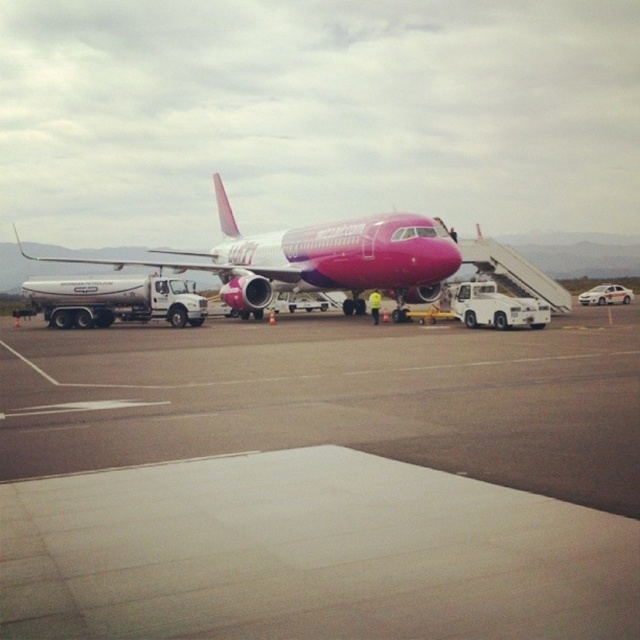
How far apart are pink glossy airplane at center and white metallic fuel truck at left?

The distance of pink glossy airplane at center from white metallic fuel truck at left is 25.01 feet.

Is point (403, 257) positioned behind point (60, 300)?

No, it is not.

Locate an element on the screen. Image resolution: width=640 pixels, height=640 pixels. pink glossy airplane at center is located at coordinates 316,259.

Can you confirm if smooth concrete tarmac at center is positioned above pink glossy airplane at center?

Incorrect, smooth concrete tarmac at center is not positioned above pink glossy airplane at center.

Looking at this image, which is more to the right, smooth concrete tarmac at center or pink glossy airplane at center?

smooth concrete tarmac at center

Image resolution: width=640 pixels, height=640 pixels. Describe the element at coordinates (321, 481) in the screenshot. I see `smooth concrete tarmac at center` at that location.

You are a GUI agent. You are given a task and a screenshot of the screen. Output one action in this format:
    pyautogui.click(x=<x>, y=<y>)
    Task: Click on the smooth concrete tarmac at center
    The width and height of the screenshot is (640, 640).
    Given the screenshot: What is the action you would take?
    pyautogui.click(x=321, y=481)

Locate an element on the screen. The image size is (640, 640). smooth concrete tarmac at center is located at coordinates (321, 481).

Is point (326, 355) farther from viewer compared to point (44, 282)?

No.

Image resolution: width=640 pixels, height=640 pixels. Find the location of `smooth concrete tarmac at center`. smooth concrete tarmac at center is located at coordinates (321, 481).

The height and width of the screenshot is (640, 640). I want to click on smooth concrete tarmac at center, so click(x=321, y=481).